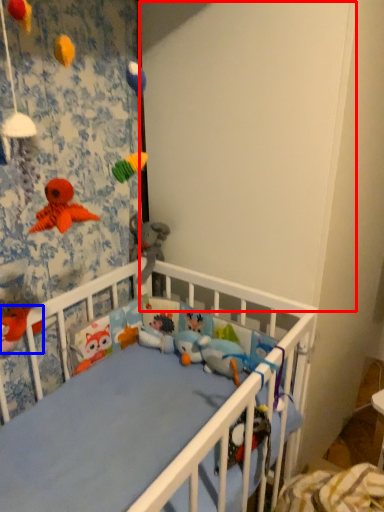
Question: Which of the following is the farthest to the observer, backdrop (highlighted by a red box) or toy (highlighted by a blue box)?

Choices:
 (A) backdrop
 (B) toy

Answer: (B)